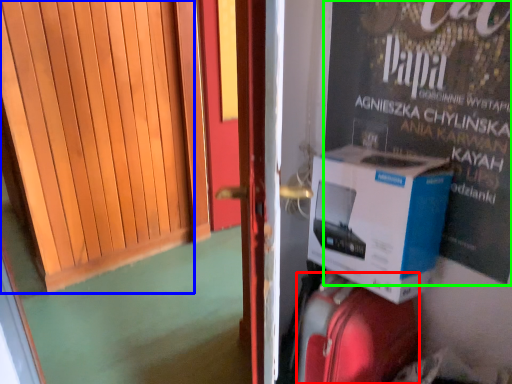
Question: Which object is the closest to the suitcase (highlighted by a red box)? Choose among these: door (highlighted by a blue box) or advertisement (highlighted by a green box).

Choices:
 (A) door
 (B) advertisement

Answer: (B)